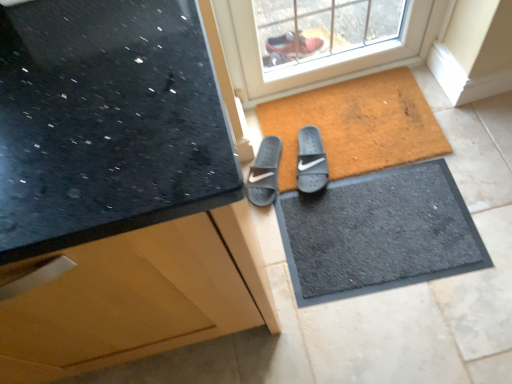
Question: From the image's perspective, is black rubber doormat at center beneath gray rubber slide at center, the 2th footwear positioned from the right?

Choices:
 (A) no
 (B) yes

Answer: (B)

Question: From a real-world perspective, is black rubber doormat at center positioned under gray rubber slide at center, the 2th footwear positioned from the right, based on gravity?

Choices:
 (A) yes
 (B) no

Answer: (A)

Question: Is black rubber doormat at center aimed at gray rubber slide at center, which is the 1th footwear in left-to-right order?

Choices:
 (A) no
 (B) yes

Answer: (A)

Question: From a real-world perspective, is black rubber doormat at center physically above gray rubber slide at center, which is the 1th footwear in left-to-right order?

Choices:
 (A) yes
 (B) no

Answer: (B)

Question: Considering the relative sizes of black rubber doormat at center and gray rubber slide at center, the 2th footwear positioned from the right, in the image provided, is black rubber doormat at center shorter than gray rubber slide at center, the 2th footwear positioned from the right,?

Choices:
 (A) yes
 (B) no

Answer: (A)

Question: From the image's perspective, is black rubber doormat at center located above gray rubber slide at center, which is the 1th footwear in left-to-right order?

Choices:
 (A) yes
 (B) no

Answer: (B)

Question: Considering the relative sizes of gray rubber slide at center, which ranks as the 2th footwear in left-to-right order, and black rubber doormat at center in the image provided, is gray rubber slide at center, which ranks as the 2th footwear in left-to-right order, wider than black rubber doormat at center?

Choices:
 (A) no
 (B) yes

Answer: (A)

Question: Is gray rubber slide at center, the 1th footwear in the right-to-left sequence, taller than black rubber doormat at center?

Choices:
 (A) yes
 (B) no

Answer: (A)

Question: Are gray rubber slide at center, which ranks as the 2th footwear in left-to-right order, and black rubber doormat at center making contact?

Choices:
 (A) yes
 (B) no

Answer: (B)

Question: Is black rubber doormat at center surrounded by gray rubber slide at center, the 1th footwear in the right-to-left sequence?

Choices:
 (A) no
 (B) yes

Answer: (A)

Question: Is the position of gray rubber slide at center, the 1th footwear in the right-to-left sequence, more distant than that of black rubber doormat at center?

Choices:
 (A) yes
 (B) no

Answer: (A)

Question: Considering the relative positions of black rubber doormat at center and brown textured mat at center in the image provided, is black rubber doormat at center to the left of brown textured mat at center from the viewer's perspective?

Choices:
 (A) no
 (B) yes

Answer: (A)